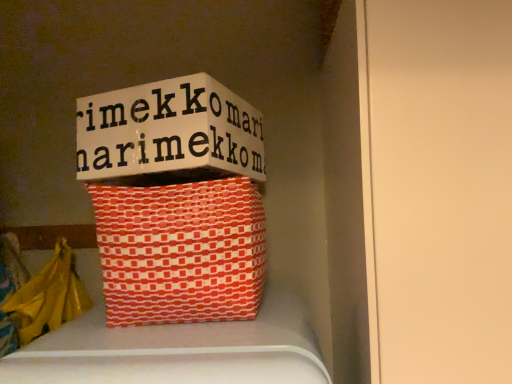
What do you see at coordinates (49, 297) in the screenshot? I see `yellow plastic bag at lower left` at bounding box center [49, 297].

This screenshot has height=384, width=512. I want to click on yellow plastic bag at lower left, so click(49, 297).

How many degrees apart are the facing directions of orange woven basket at center and yellow plastic bag at lower left?

The facing directions of orange woven basket at center and yellow plastic bag at lower left are 2.63 degrees apart.

Does orange woven basket at center have a smaller size compared to yellow plastic bag at lower left?

No.

Does orange woven basket at center contain yellow plastic bag at lower left?

No.

Who is smaller, white cardboard box at upper center or yellow plastic bag at lower left?

Smaller between the two is yellow plastic bag at lower left.

Considering the points (101, 108) and (63, 315), which point is behind, point (101, 108) or point (63, 315)?

Positioned behind is point (63, 315).

Does white cardboard box at upper center appear on the right side of yellow plastic bag at lower left?

Indeed, white cardboard box at upper center is positioned on the right side of yellow plastic bag at lower left.

Is white cardboard box at upper center positioned with its back to yellow plastic bag at lower left?

No, white cardboard box at upper center is not facing the opposite direction of yellow plastic bag at lower left.

Based on the photo, based on their positions, is yellow plastic bag at lower left located to the left or right of white cardboard box at upper center?

Clearly, yellow plastic bag at lower left is on the left of white cardboard box at upper center in the image.

Considering the sizes of objects yellow plastic bag at lower left and white cardboard box at upper center in the image provided, who is thinner, yellow plastic bag at lower left or white cardboard box at upper center?

With smaller width is yellow plastic bag at lower left.

From their relative heights in the image, would you say yellow plastic bag at lower left is taller or shorter than white cardboard box at upper center?

Clearly, yellow plastic bag at lower left is taller compared to white cardboard box at upper center.

In the scene shown: Can you tell me how much white cardboard box at upper center and orange woven basket at center differ in facing direction?

There is a 20.5-degree angle between the facing directions of white cardboard box at upper center and orange woven basket at center.

From the image's perspective, is white cardboard box at upper center on orange woven basket at center?

Yes, from the image's perspective, white cardboard box at upper center is over orange woven basket at center.

How far apart are white cardboard box at upper center and orange woven basket at center?

A distance of 5.98 inches exists between white cardboard box at upper center and orange woven basket at center.

Does white cardboard box at upper center lie behind orange woven basket at center?

Yes, the depth of white cardboard box at upper center is greater than that of orange woven basket at center.

Is yellow plastic bag at lower left not inside orange woven basket at center?

Indeed, yellow plastic bag at lower left is completely outside orange woven basket at center.

Visually, is yellow plastic bag at lower left positioned to the left or to the right of orange woven basket at center?

In the image, yellow plastic bag at lower left appears on the left side of orange woven basket at center.

Image resolution: width=512 pixels, height=384 pixels. What are the coordinates of `basket that appears on the right of yellow plastic bag at lower left` in the screenshot? It's located at (181, 251).

Is point (58, 280) farther from camera compared to point (219, 292)?

Yes, point (58, 280) is farther from viewer.

Considering the points (137, 284) and (106, 142), which point is in front, point (137, 284) or point (106, 142)?

The point (137, 284) is closer to the camera.

In order to click on basket that appears in front of the white cardboard box at upper center in this screenshot , I will do coord(181,251).

Is orange woven basket at center smaller than white cardboard box at upper center?

Actually, orange woven basket at center might be larger than white cardboard box at upper center.

How much distance is there between orange woven basket at center and white cardboard box at upper center?

5.98 inches.

Find the location of a particular element. The image size is (512, 384). material beneath the orange woven basket at center (from a real-world perspective) is located at coordinates (49, 297).

Find the location of a particular element. The image size is (512, 384). material that appears below the white cardboard box at upper center (from the image's perspective) is located at coordinates (49, 297).

Looking at the image, which one is located closer to yellow plastic bag at lower left, white cardboard box at upper center or orange woven basket at center?

The object closer to yellow plastic bag at lower left is orange woven basket at center.

Which object lies further to the anchor point white cardboard box at upper center, orange woven basket at center or yellow plastic bag at lower left?

yellow plastic bag at lower left lies further to white cardboard box at upper center than the other object.

Which object lies further to the anchor point orange woven basket at center, white cardboard box at upper center or yellow plastic bag at lower left?

yellow plastic bag at lower left is positioned further to the anchor orange woven basket at center.

Based on their spatial positions, is yellow plastic bag at lower left or white cardboard box at upper center further from orange woven basket at center?

yellow plastic bag at lower left is further to orange woven basket at center.

Which object lies further to the anchor point white cardboard box at upper center, yellow plastic bag at lower left or orange woven basket at center?

Among the two, yellow plastic bag at lower left is located further to white cardboard box at upper center.

Consider the image. Looking at the image, which one is located further to yellow plastic bag at lower left, orange woven basket at center or white cardboard box at upper center?

white cardboard box at upper center is further to yellow plastic bag at lower left.

At what (x,y) coordinates should I click in order to perform the action: click on box located between yellow plastic bag at lower left and orange woven basket at center in the left-right direction. Please return your answer as a coordinate pair (x, y). Looking at the image, I should click on [168, 134].